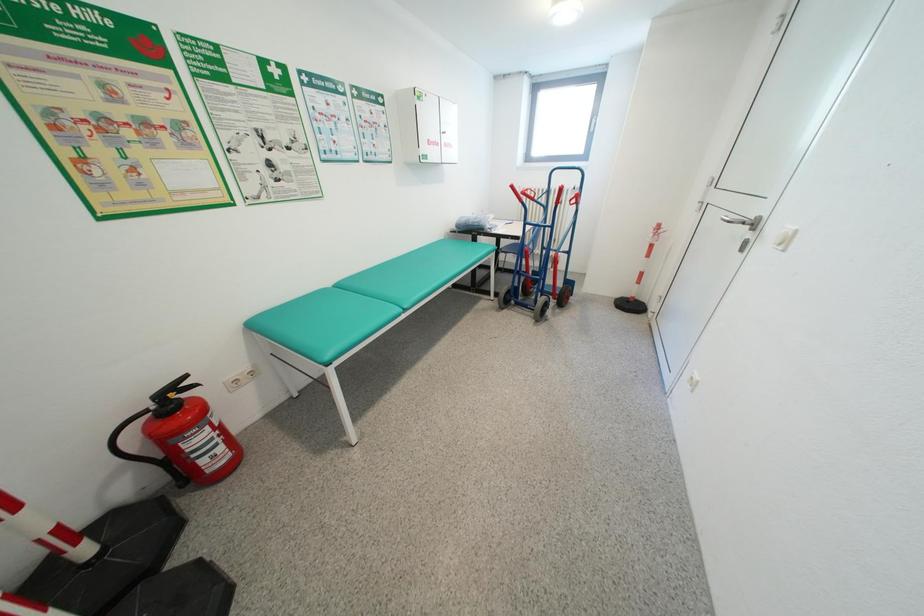
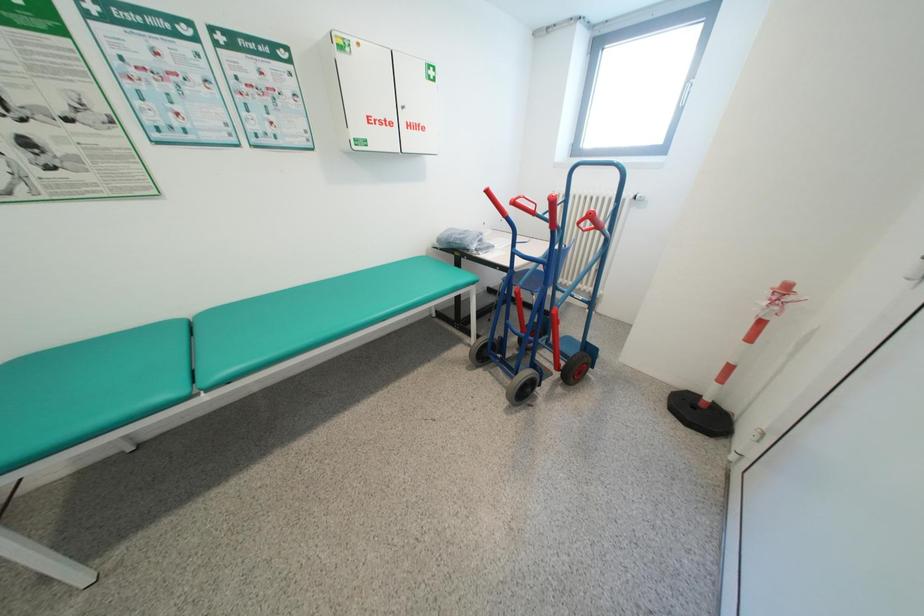
In a continuous first-person perspective shot, in which direction is the camera moving?

The movement direction of the cameraman is right, forward.